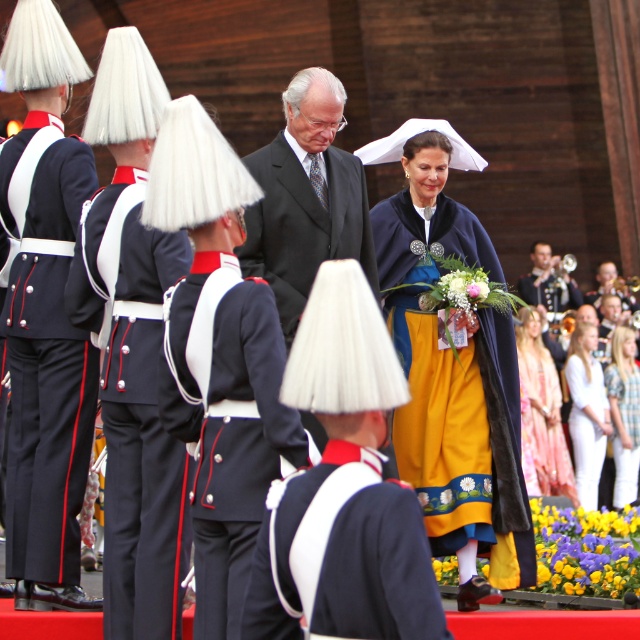
You are a photographer at the event and need to position yourself to capture the navy blue fabric uniform at center in the frame. According to the coordinates provided, where should you aim your camera?

The navy blue fabric uniform at center is located at coordinates point (227, 420), so aim your camera there to capture it.

You are standing at the event and want to take a photo of the point marked at coordinates point (598, 368). If your camera has a maximum focus range of 80 meters, will you be able to focus on that point?

The point (598, 368) is 85.21 meters away from the viewer, which exceeds the camera maximum focus range of 80 meters. Therefore, the camera cannot focus on that point.

You are a photographer at the event and want to focus on both point (19, 234) and point (582, 426) in your shot. Which point should you adjust your focus to first to ensure both are in clear view?

Point (19, 234) is closer to the camera than point (582, 426), so you should focus on point (19, 234) first to ensure both points are within the depth of field.